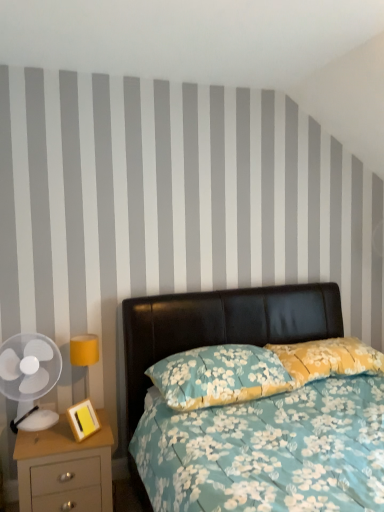
Question: Does floral fabric pillow at center, the first pillow viewed from the right, touch floral fabric bed at center?

Choices:
 (A) yes
 (B) no

Answer: (B)

Question: Is floral fabric pillow at center, the first pillow viewed from the right, closer to camera compared to floral fabric bed at center?

Choices:
 (A) no
 (B) yes

Answer: (A)

Question: Is floral fabric bed at center located within floral fabric pillow at center, the first pillow viewed from the right?

Choices:
 (A) no
 (B) yes

Answer: (A)

Question: Does floral fabric pillow at center, the second pillow from the left, have a greater width compared to floral fabric bed at center?

Choices:
 (A) no
 (B) yes

Answer: (A)

Question: Is floral fabric pillow at center, the second pillow from the left, looking in the opposite direction of floral fabric bed at center?

Choices:
 (A) no
 (B) yes

Answer: (B)

Question: Which is correct: floral fabric pillow at center, the first pillow viewed from the right, is inside matte yellow lampshade at left, or outside of it?

Choices:
 (A) outside
 (B) inside

Answer: (A)

Question: Considering the positions of floral fabric pillow at center, the first pillow viewed from the right, and matte yellow lampshade at left in the image, is floral fabric pillow at center, the first pillow viewed from the right, taller or shorter than matte yellow lampshade at left?

Choices:
 (A) short
 (B) tall

Answer: (A)

Question: From the image's perspective, is floral fabric pillow at center, the first pillow viewed from the right, located above or below matte yellow lampshade at left?

Choices:
 (A) above
 (B) below

Answer: (A)

Question: In the image, is floral fabric pillow at center, the first pillow viewed from the right, positioned in front of or behind matte yellow lampshade at left?

Choices:
 (A) front
 (B) behind

Answer: (A)

Question: From a real-world perspective, is floral fabric pillow at center, placed as the 2th pillow when sorted from right to left, positioned above or below matte yellow lampshade at left?

Choices:
 (A) below
 (B) above

Answer: (B)

Question: Is point (x=251, y=349) closer or farther from the camera than point (x=86, y=394)?

Choices:
 (A) farther
 (B) closer

Answer: (B)

Question: Considering their positions, is floral fabric pillow at center, which is the first pillow from left to right, located in front of or behind matte yellow lampshade at left?

Choices:
 (A) front
 (B) behind

Answer: (A)

Question: In terms of height, does floral fabric pillow at center, placed as the 2th pillow when sorted from right to left, look taller or shorter compared to matte yellow lampshade at left?

Choices:
 (A) tall
 (B) short

Answer: (B)

Question: Looking at their shapes, would you say transparent plastic fan at left is wider or thinner than matte yellow lampshade at left?

Choices:
 (A) thin
 (B) wide

Answer: (B)

Question: From a real-world perspective, is transparent plastic fan at left physically located above or below matte yellow lampshade at left?

Choices:
 (A) above
 (B) below

Answer: (A)